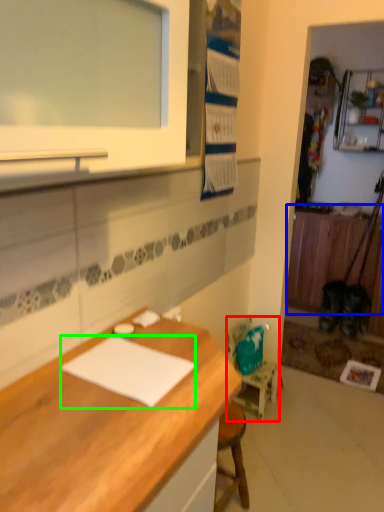
Question: Estimate the real-world distances between objects in this image. Which object is farther from chair (highlighted by a red box), cabinetry (highlighted by a blue box) or notepad (highlighted by a green box)?

Choices:
 (A) cabinetry
 (B) notepad

Answer: (A)